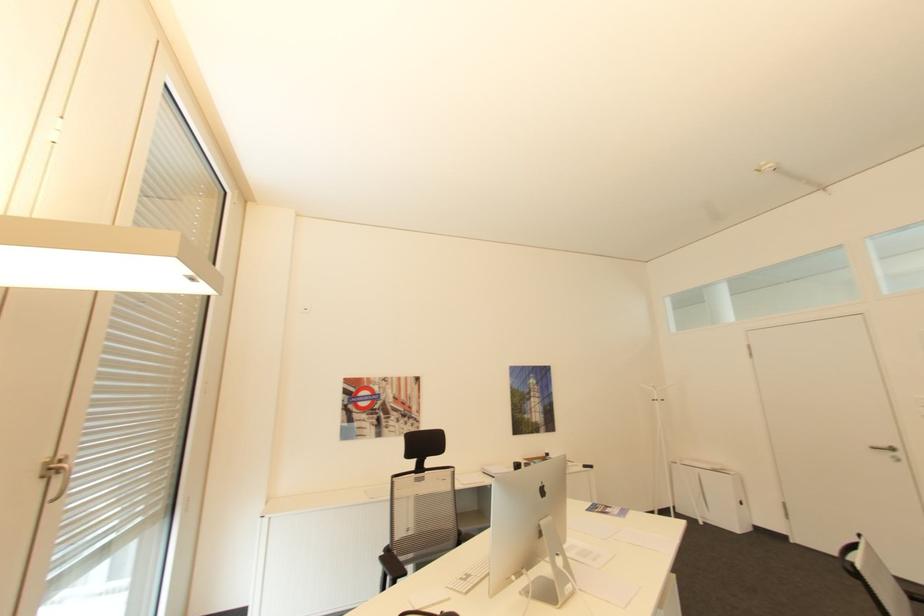
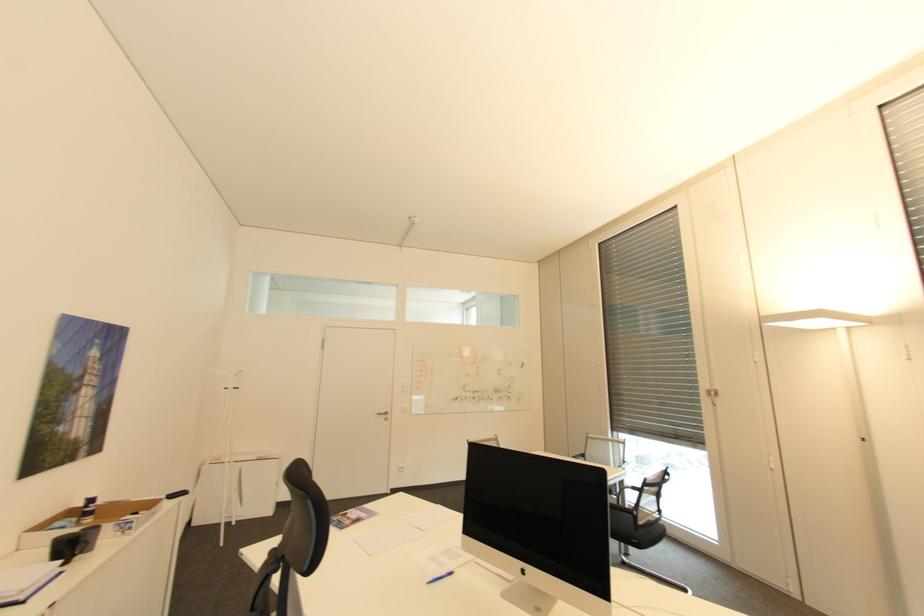
Locate, in the second image, the point that corresponds to point (596, 466) in the first image.

(188, 493)